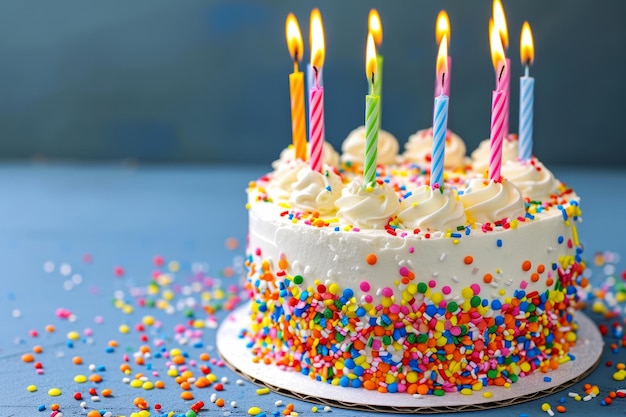
At what (x,y) coordinates should I click in order to perform the action: click on birthday candle flames. Please return your answer as a coordinate pair (x, y). Looking at the image, I should click on (371, 61), (320, 46), (289, 38), (316, 26), (379, 27), (443, 27), (444, 68), (501, 55), (528, 52), (504, 24).